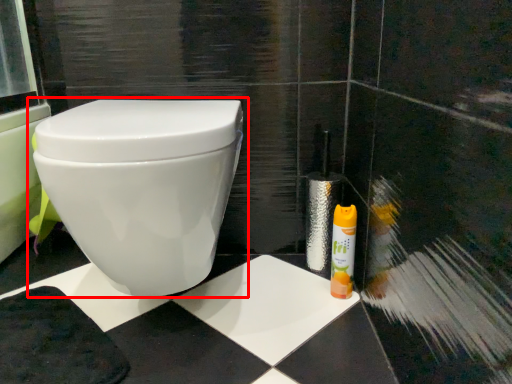
Question: From the image's perspective, considering the relative positions of toilet (annotated by the red box) and cleaning product in the image provided, where is toilet (annotated by the red box) located with respect to the staircase?

Choices:
 (A) above
 (B) below

Answer: (A)